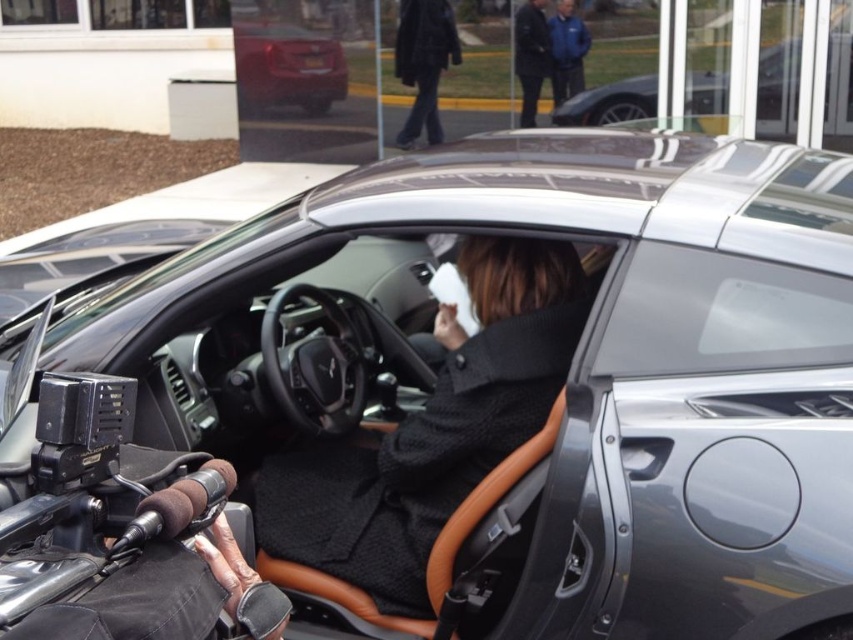
You are standing in front of a modern sports car and see a point marked at coordinates [424,61]. What object is located at that point?

The point at coordinates [424,61] marks the dark gray pants at upper center.

You are a delivery person who needs to place a package on the shiny metallic car at upper center. However, there is a dark blue jacket at upper center in the way. Can you place the package on the car without moving the jacket?

The shiny metallic car at upper center is positioned under the dark blue jacket at upper center, meaning the jacket is above the car. Therefore, you can place the package on the car without needing to move the jacket since it is elevated above the car.